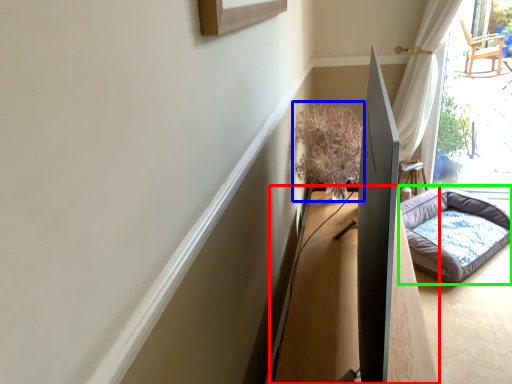
Question: Which is farther away from table (highlighted by a red box)? plant (highlighted by a blue box) or dog bed (highlighted by a green box)?

Choices:
 (A) plant
 (B) dog bed

Answer: (B)